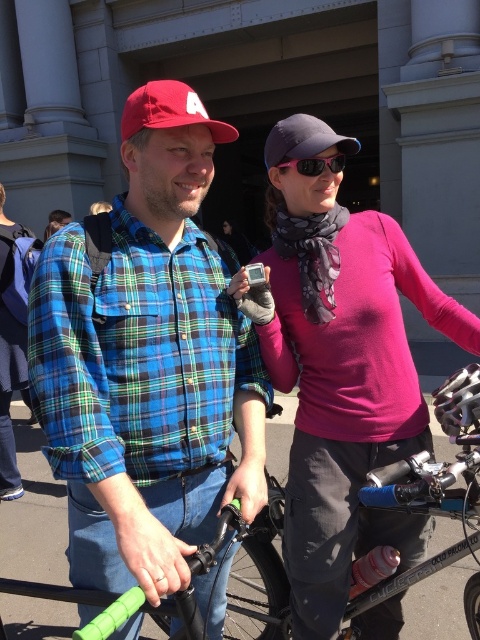
Is pink matte sweater at center to the left of pink matte sunglasses at upper center from the viewer's perspective?

Incorrect, pink matte sweater at center is not on the left side of pink matte sunglasses at upper center.

Does pink matte sweater at center have a lesser height compared to pink matte sunglasses at upper center?

No, pink matte sweater at center is not shorter than pink matte sunglasses at upper center.

Find the location of a particular element. This screenshot has height=640, width=480. pink matte sweater at center is located at coordinates (343, 380).

Can you confirm if blue plaid shirt at center is positioned to the right of pink matte sunglasses at upper center?

In fact, blue plaid shirt at center is to the left of pink matte sunglasses at upper center.

Describe the element at coordinates (147, 364) in the screenshot. I see `blue plaid shirt at center` at that location.

Does point (144, 365) lie behind point (302, 164)?

No, (144, 365) is in front of (302, 164).

Image resolution: width=480 pixels, height=640 pixels. Identify the location of blue plaid shirt at center. (147, 364).

Does point (332, 637) come behind point (328, 134)?

Yes, it is.

What do you see at coordinates (343, 380) in the screenshot? I see `pink matte sweater at center` at bounding box center [343, 380].

Find the location of a particular element. The width and height of the screenshot is (480, 640). pink matte sweater at center is located at coordinates (343, 380).